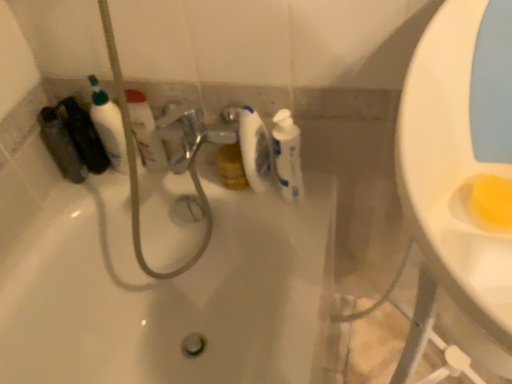
Question: Is white glossy toilet paper at center positioned beyond the bounds of white glossy bottle at upper left, arranged as the 1th cleaning product when viewed from the left?

Choices:
 (A) yes
 (B) no

Answer: (A)

Question: Does white glossy toilet paper at center come behind white glossy bottle at upper left, which ranks as the second cleaning product in right-to-left order?

Choices:
 (A) yes
 (B) no

Answer: (B)

Question: Is white glossy toilet paper at center oriented away from white glossy bottle at upper left, arranged as the 1th cleaning product when viewed from the left?

Choices:
 (A) no
 (B) yes

Answer: (A)

Question: Could you tell me if white glossy toilet paper at center is facing white glossy bottle at upper left, which ranks as the second cleaning product in right-to-left order?

Choices:
 (A) yes
 (B) no

Answer: (B)

Question: Considering the relative sizes of white glossy toilet paper at center and white glossy bottle at upper left, which ranks as the second cleaning product in right-to-left order, in the image provided, is white glossy toilet paper at center wider than white glossy bottle at upper left, which ranks as the second cleaning product in right-to-left order,?

Choices:
 (A) no
 (B) yes

Answer: (B)

Question: Considering the relative sizes of white glossy toilet paper at center and white glossy bottle at upper left, which ranks as the second cleaning product in right-to-left order, in the image provided, is white glossy toilet paper at center smaller than white glossy bottle at upper left, which ranks as the second cleaning product in right-to-left order,?

Choices:
 (A) yes
 (B) no

Answer: (A)

Question: From a real-world perspective, does translucent plastic mouthwash at left stand above white glossy toilet paper at center?

Choices:
 (A) yes
 (B) no

Answer: (B)

Question: Is translucent plastic mouthwash at left at the right side of white glossy toilet paper at center?

Choices:
 (A) yes
 (B) no

Answer: (B)

Question: From a real-world perspective, is translucent plastic mouthwash at left under white glossy toilet paper at center?

Choices:
 (A) no
 (B) yes

Answer: (B)

Question: Are translucent plastic mouthwash at left and white glossy toilet paper at center located far from each other?

Choices:
 (A) yes
 (B) no

Answer: (B)

Question: From the image's perspective, is translucent plastic mouthwash at left above white glossy toilet paper at center?

Choices:
 (A) yes
 (B) no

Answer: (A)

Question: Considering the relative sizes of translucent plastic mouthwash at left and white glossy toilet paper at center in the image provided, is translucent plastic mouthwash at left bigger than white glossy toilet paper at center?

Choices:
 (A) yes
 (B) no

Answer: (A)

Question: Is white glossy bottle at center, the second cleaning product from the left, oriented towards white glossy bottle at upper left, which ranks as the second cleaning product in right-to-left order?

Choices:
 (A) yes
 (B) no

Answer: (B)